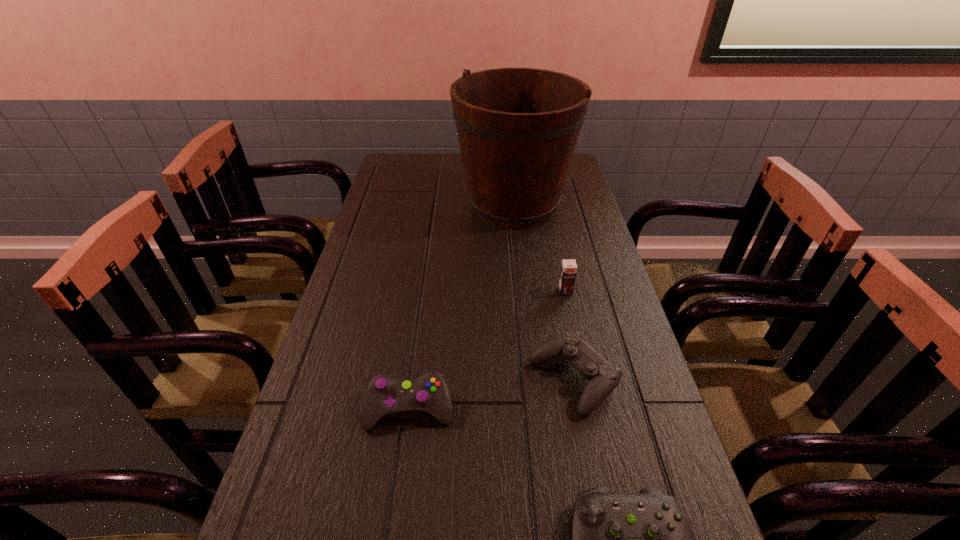
Find the location of a particular element. The width and height of the screenshot is (960, 540). the farthest object is located at coordinates (518, 128).

Locate an element on the screen. The image size is (960, 540). bucket is located at coordinates [518, 128].

The image size is (960, 540). Find the location of `the fourth nearest object`. the fourth nearest object is located at coordinates (568, 272).

You are a GUI agent. You are given a task and a screenshot of the screen. Output one action in this format:
    pyautogui.click(x=<x>, y=<y>)
    Task: Click on the fourth shortest object
    This screenshot has height=540, width=960.
    Given the screenshot: What is the action you would take?
    pyautogui.click(x=568, y=272)

Find the location of a particular element. The width and height of the screenshot is (960, 540). the leftmost control is located at coordinates pyautogui.click(x=385, y=397).

Locate an element on the screen. vacant space located 0.130m on the back of the farthest object is located at coordinates (509, 160).

At what (x,y) coordinates should I click in order to perform the action: click on vacant region located on the front label of the fourth nearest object. Please return your answer as a coordinate pair (x, y). Looking at the image, I should click on (569, 312).

This screenshot has height=540, width=960. I want to click on free space located on the right of the leftmost control, so click(555, 409).

You are a GUI agent. You are given a task and a screenshot of the screen. Output one action in this format:
    pyautogui.click(x=<x>, y=<y>)
    Task: Click on the object situated at the far edge
    This screenshot has width=960, height=540.
    Given the screenshot: What is the action you would take?
    pyautogui.click(x=518, y=128)

Where is `object located in the left edge section of the desktop`? The width and height of the screenshot is (960, 540). object located in the left edge section of the desktop is located at coordinates (385, 397).